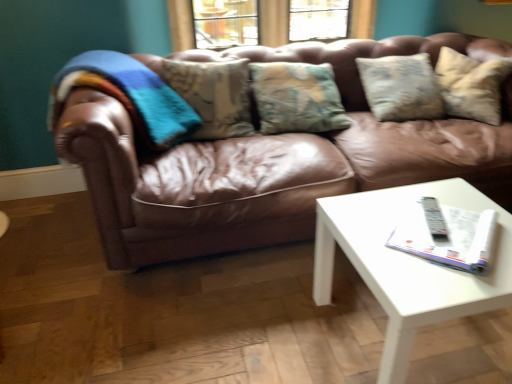
Locate an element on the screen. The width and height of the screenshot is (512, 384). vacant space underneath white glossy coffee table at lower right (from a real-world perspective) is located at coordinates (410, 350).